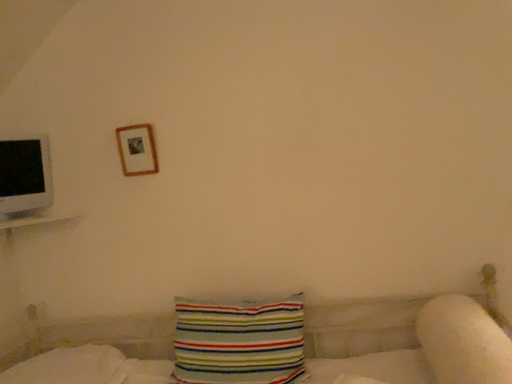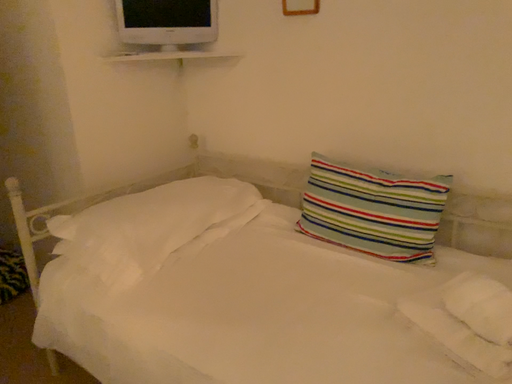
Question: Which way did the camera rotate in the video?

Choices:
 (A) rotated right
 (B) rotated left

Answer: (B)